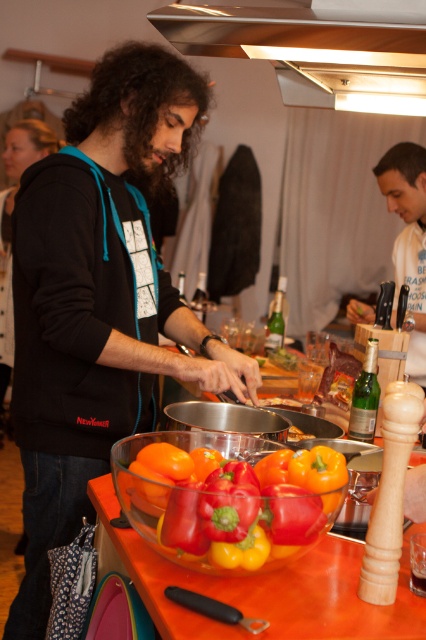
Question: Is shiny glass bowl at center thinner than stainless steel exhaust hood at upper center?

Choices:
 (A) no
 (B) yes

Answer: (B)

Question: Which point is farther to the camera?

Choices:
 (A) shiny glass bowl at center
 (B) white cotton shirt at upper right
 (C) stainless steel exhaust hood at upper center
 (D) translucent glass bowl at center

Answer: (B)

Question: Which of the following is the closest to the observer?

Choices:
 (A) shiny glass bowl at center
 (B) stainless steel exhaust hood at upper center
 (C) translucent glass bowl at center
 (D) black matte hoodie at center

Answer: (C)

Question: Is stainless steel exhaust hood at upper center positioned behind translucent glass bowl at center?

Choices:
 (A) yes
 (B) no

Answer: (A)

Question: Is shiny glass bowl at center positioned at the back of translucent glass bowl at center?

Choices:
 (A) yes
 (B) no

Answer: (A)

Question: Which object is positioned farthest from the shiny glass bowl at center?

Choices:
 (A) translucent glass bowl at center
 (B) white cotton shirt at upper right

Answer: (B)